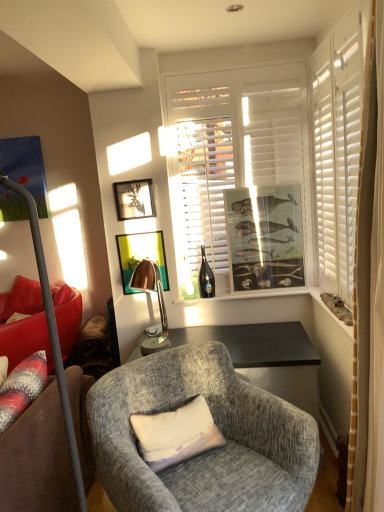
At what (x,y) coordinates should I click in order to perform the action: click on vacant space situated above white wood window at center (from a real-world perspective). Please return your answer as a coordinate pair (x, y). This screenshot has height=512, width=384. Looking at the image, I should click on (238, 58).